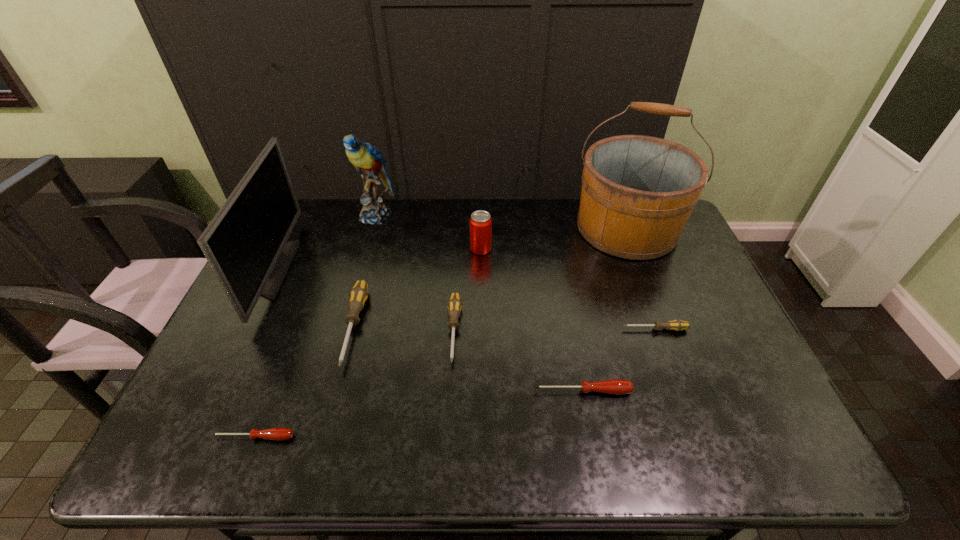
Where is `the tallest object`? The width and height of the screenshot is (960, 540). the tallest object is located at coordinates (638, 192).

The height and width of the screenshot is (540, 960). In order to click on parrot in this screenshot , I will do `click(368, 160)`.

Find the location of a particular element. black monitor is located at coordinates (245, 244).

I want to click on the leftmost object, so (x=245, y=244).

Where is `the fourth object from right to left`? The image size is (960, 540). the fourth object from right to left is located at coordinates (480, 222).

At what (x,y) coordinates should I click in order to perform the action: click on can. Please return your answer as a coordinate pair (x, y). The image size is (960, 540). Looking at the image, I should click on (480, 222).

Where is `the biggest gray screwdriver`? The width and height of the screenshot is (960, 540). the biggest gray screwdriver is located at coordinates (358, 294).

At what (x,y) coordinates should I click in order to perform the action: click on the tallest screwdriver. Please return your answer as a coordinate pair (x, y). Image resolution: width=960 pixels, height=540 pixels. Looking at the image, I should click on (358, 294).

At what (x,y) coordinates should I click in order to perform the action: click on the fifth object from left to right. Please return your answer as a coordinate pair (x, y). This screenshot has height=540, width=960. Looking at the image, I should click on pos(454,305).

Image resolution: width=960 pixels, height=540 pixels. I want to click on the third screwdriver from right to left, so click(454, 305).